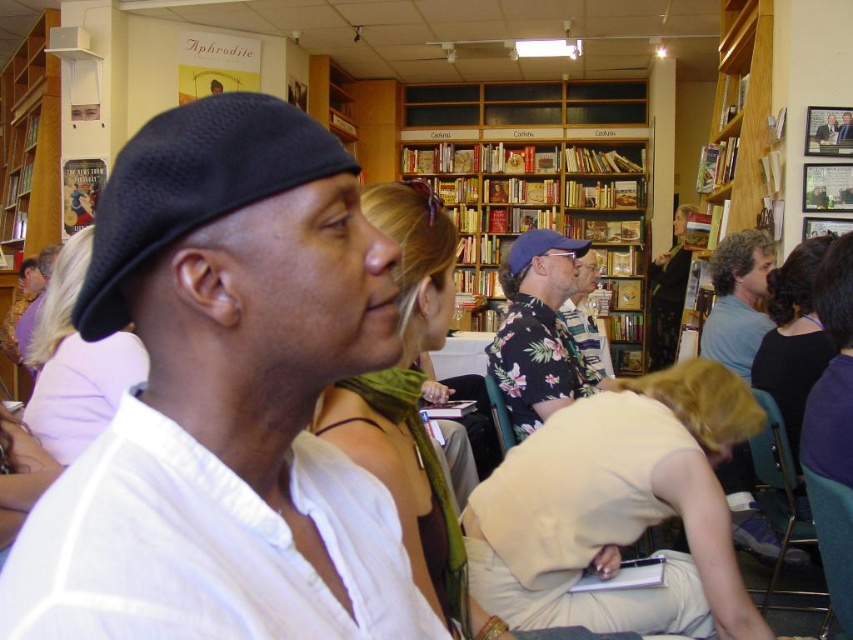
Question: Among these objects, which one is nearest to the camera?

Choices:
 (A) matte black cap at left
 (B) floral print shirt at center
 (C) wooden bookshelf at upper right

Answer: (A)

Question: From the image, what is the correct spatial relationship of floral print shirt at center in relation to dark brown hair at upper right?

Choices:
 (A) above
 (B) below

Answer: (B)

Question: Is floral print shirt at center bigger than hardcover book at upper center?

Choices:
 (A) yes
 (B) no

Answer: (A)

Question: Among these points, which one is nearest to the camera?

Choices:
 (A) (683, 282)
 (B) (525, 451)

Answer: (B)

Question: Does light purple fabric at upper left have a larger size compared to wooden bookshelf at upper right?

Choices:
 (A) no
 (B) yes

Answer: (A)

Question: Which point is closer to the camera?

Choices:
 (A) light purple fabric at upper left
 (B) beige fabric dress at lower center
 (C) floral print shirt at center

Answer: (B)